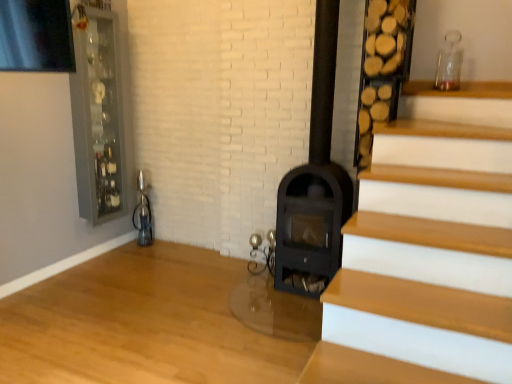
Question: From a real-world perspective, is clear glass cabinet at upper left physically located above or below black matte fireplace at center?

Choices:
 (A) below
 (B) above

Answer: (B)

Question: Considering the positions of clear glass cabinet at upper left and black matte fireplace at center in the image, is clear glass cabinet at upper left taller or shorter than black matte fireplace at center?

Choices:
 (A) tall
 (B) short

Answer: (B)

Question: Is clear glass cabinet at upper left situated inside black matte fireplace at center or outside?

Choices:
 (A) outside
 (B) inside

Answer: (A)

Question: Is black matte fireplace at center to the left or to the right of clear glass cabinet at upper left in the image?

Choices:
 (A) right
 (B) left

Answer: (A)

Question: Based on their sizes in the image, would you say black matte fireplace at center is bigger or smaller than clear glass cabinet at upper left?

Choices:
 (A) big
 (B) small

Answer: (A)

Question: Considering the positions of black matte fireplace at center and clear glass cabinet at upper left in the image, is black matte fireplace at center wider or thinner than clear glass cabinet at upper left?

Choices:
 (A) thin
 (B) wide

Answer: (B)

Question: Is point (318, 147) positioned closer to the camera than point (104, 203)?

Choices:
 (A) closer
 (B) farther

Answer: (A)